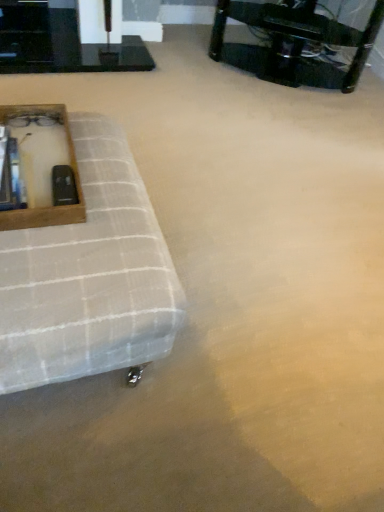
Question: From the image's perspective, is black glossy table at upper left, the 2th table viewed from the right, above or below wooden frame at left?

Choices:
 (A) above
 (B) below

Answer: (A)

Question: Does point (102, 50) appear closer or farther from the camera than point (49, 220)?

Choices:
 (A) closer
 (B) farther

Answer: (B)

Question: Considering the real-world distances, which object is farthest from the black glossy table at upper left, the 2th table viewed from the right?

Choices:
 (A) wooden frame at left
 (B) white textured ottoman at left
 (C) black plastic table at upper right, acting as the second table starting from the left

Answer: (B)

Question: Which of these objects is positioned closest to the wooden frame at left?

Choices:
 (A) black glossy table at upper left, the first table when ordered from left to right
 (B) black plastic table at upper right, positioned as the first table in right-to-left order
 (C) white textured ottoman at left

Answer: (C)